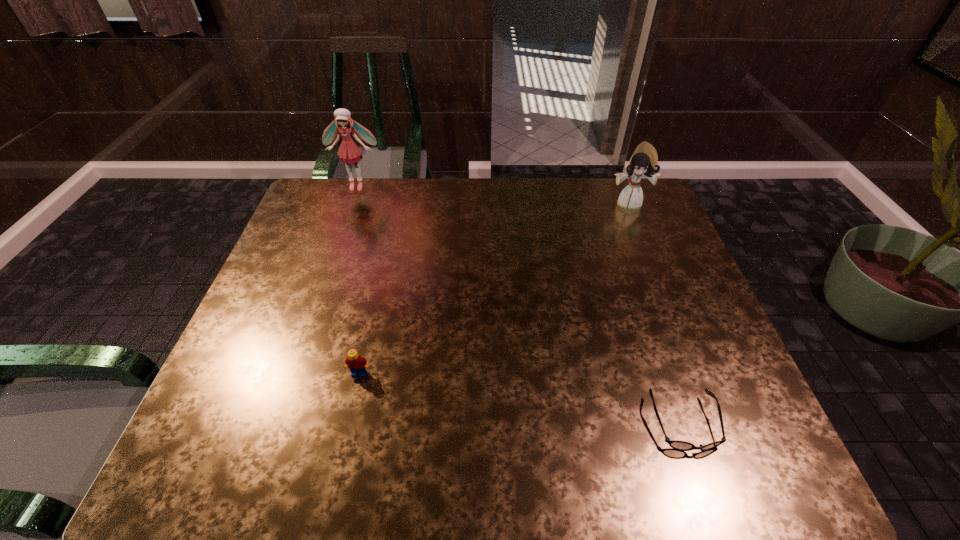
The image size is (960, 540). Identify the location of the farthest object. (349, 152).

This screenshot has height=540, width=960. What are the coordinates of `the taller doll` in the screenshot? It's located at (349, 152).

Find the location of a particular element. The image size is (960, 540). the right doll is located at coordinates (643, 163).

You are a GUI agent. You are given a task and a screenshot of the screen. Output one action in this format:
    pyautogui.click(x=<x>, y=<y>)
    Task: Click on the nearer doll
    Image resolution: width=960 pixels, height=540 pixels.
    Given the screenshot: What is the action you would take?
    pyautogui.click(x=643, y=163)

You are a GUI agent. You are given a task and a screenshot of the screen. Output one action in this format:
    pyautogui.click(x=<x>, y=<y>)
    Task: Click on the second shortest object
    
    Given the screenshot: What is the action you would take?
    357,364

Locate an element on the screen. the third object from right to left is located at coordinates coord(357,364).

This screenshot has width=960, height=540. In order to click on sunglasses in this screenshot , I will do `click(675, 444)`.

You are a GUI agent. You are given a task and a screenshot of the screen. Output one action in this format:
    pyautogui.click(x=<x>, y=<y>)
    Task: Click on the nearest object
    The image size is (960, 540).
    Given the screenshot: What is the action you would take?
    pyautogui.click(x=675, y=444)

Identify the location of free space located 0.330m on the front-facing side of the farther doll. Image resolution: width=960 pixels, height=540 pixels. (331, 260).

I want to click on vacant area located at the front face of the nearer doll, so click(669, 305).